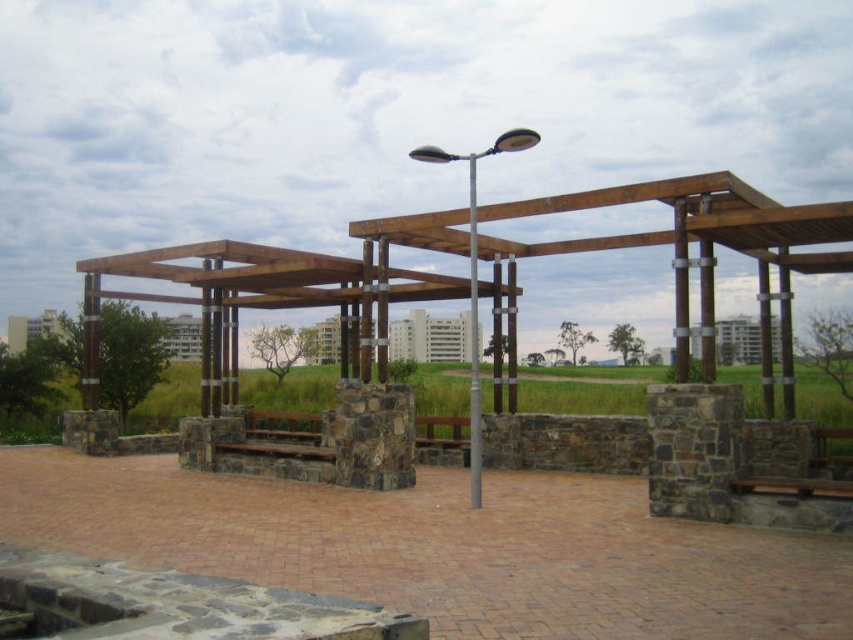
You are planning to place a new bench that is 1.2 meters wide in the park. You see the metallic pole at center and the wooden bench at center. Which existing object is wider than the new bench?

The metallic pole at center is wider than the wooden bench at center, so the metallic pole at center is wider than the new bench since it surpasses the bench width.

You are standing at the center of the park and see a point marked at coordinates (473, 342). Which object does this point belong to?

The point belongs to the metallic pole at center.